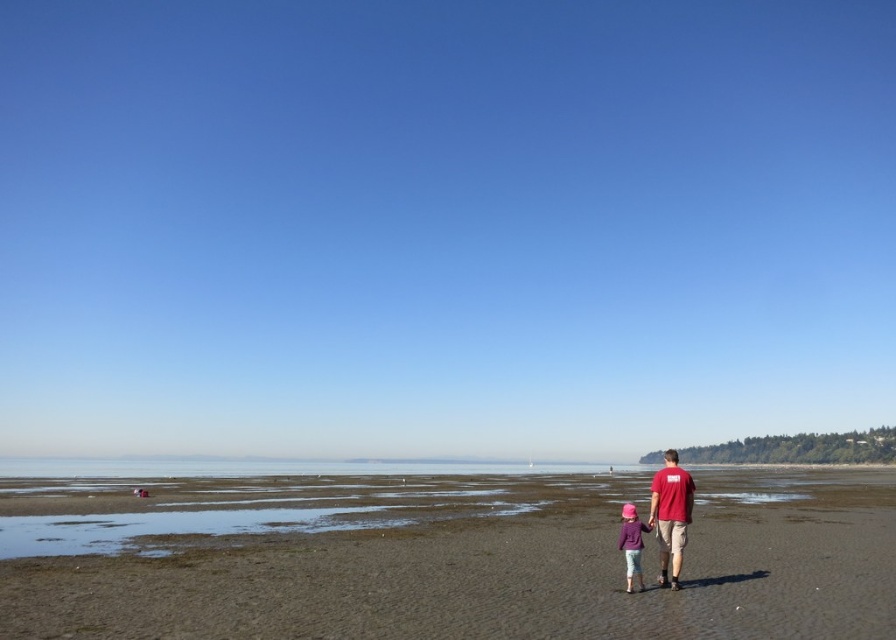
You are standing at the point labeled as point (438, 556) in the image. Based on the scene description, what type of terrain are you currently standing on?

The point (438, 556) corresponds to the brown sandy beach at lower center, so you are standing on a sandy beach.

You are standing on the brown sandy beach at lower center and looking at the pink fabric hat at lower center. Which object is closer to the horizon?

The brown sandy beach at lower center is much taller than the pink fabric hat at lower center, so the pink fabric hat at lower center is closer to the horizon.